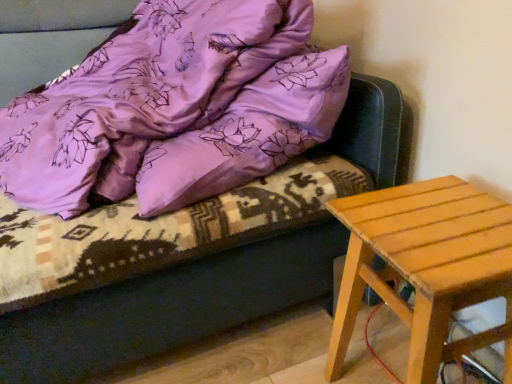
Question: Considering the positions of satin purple blanket at upper left and wooden stool at right in the image, is satin purple blanket at upper left taller or shorter than wooden stool at right?

Choices:
 (A) short
 (B) tall

Answer: (B)

Question: From the image's perspective, is satin purple blanket at upper left located above or below wooden stool at right?

Choices:
 (A) above
 (B) below

Answer: (A)

Question: In terms of size, does satin purple blanket at upper left appear bigger or smaller than wooden stool at right?

Choices:
 (A) small
 (B) big

Answer: (B)

Question: Does point (384, 196) appear closer or farther from the camera than point (285, 26)?

Choices:
 (A) closer
 (B) farther

Answer: (A)

Question: From a real-world perspective, is wooden stool at right physically located above or below satin purple blanket at upper left?

Choices:
 (A) below
 (B) above

Answer: (A)

Question: Relative to satin purple blanket at upper left, is wooden stool at right in front or behind?

Choices:
 (A) front
 (B) behind

Answer: (B)

Question: From the image's perspective, is wooden stool at right located above or below satin purple blanket at upper left?

Choices:
 (A) above
 (B) below

Answer: (B)